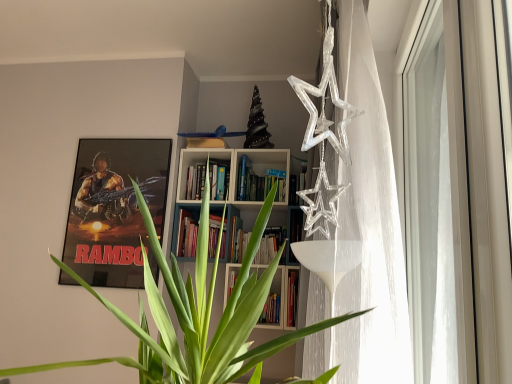
Question: From a real-world perspective, is metallic poster at upper left over transparent glass window at right?

Choices:
 (A) no
 (B) yes

Answer: (B)

Question: Considering the relative positions of metallic poster at upper left and transparent glass window at right in the image provided, is metallic poster at upper left to the right of transparent glass window at right from the viewer's perspective?

Choices:
 (A) no
 (B) yes

Answer: (A)

Question: Can you confirm if metallic poster at upper left is smaller than transparent glass window at right?

Choices:
 (A) yes
 (B) no

Answer: (A)

Question: Considering the relative positions of metallic poster at upper left and transparent glass window at right in the image provided, is metallic poster at upper left to the left of transparent glass window at right from the viewer's perspective?

Choices:
 (A) no
 (B) yes

Answer: (B)

Question: Is metallic poster at upper left positioned in front of transparent glass window at right?

Choices:
 (A) yes
 (B) no

Answer: (B)

Question: From the image's perspective, is metallic poster at upper left under transparent glass window at right?

Choices:
 (A) no
 (B) yes

Answer: (B)

Question: Is transparent glass window at right completely or partially outside of metallic poster at upper left?

Choices:
 (A) no
 (B) yes

Answer: (B)

Question: Does transparent glass window at right come behind metallic poster at upper left?

Choices:
 (A) no
 (B) yes

Answer: (A)

Question: Is there a large distance between transparent glass window at right and metallic poster at upper left?

Choices:
 (A) yes
 (B) no

Answer: (A)

Question: Is transparent glass window at right to the left of metallic poster at upper left from the viewer's perspective?

Choices:
 (A) no
 (B) yes

Answer: (A)

Question: Considering the relative sizes of transparent glass window at right and metallic poster at upper left in the image provided, is transparent glass window at right taller than metallic poster at upper left?

Choices:
 (A) yes
 (B) no

Answer: (A)

Question: Can you confirm if transparent glass window at right is bigger than metallic poster at upper left?

Choices:
 (A) yes
 (B) no

Answer: (A)

Question: From a real-world perspective, is metallic poster at upper left positioned above or below transparent glass window at right?

Choices:
 (A) below
 (B) above

Answer: (B)